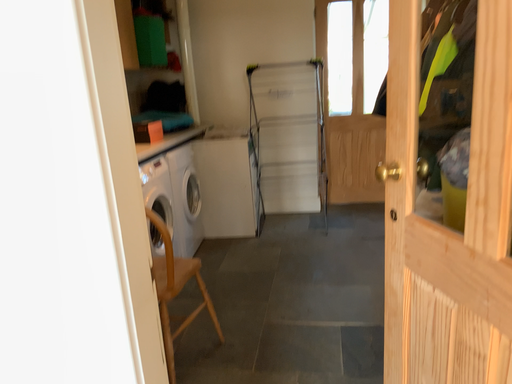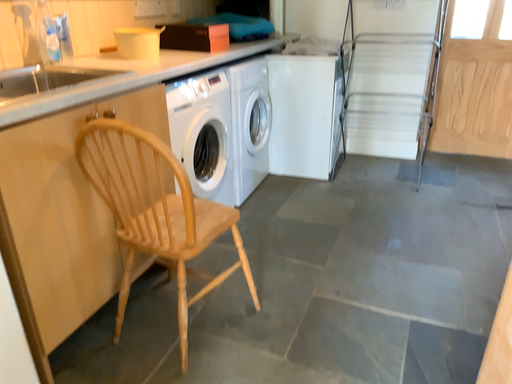
Question: How did the camera likely rotate when shooting the video?

Choices:
 (A) rotated left
 (B) rotated right

Answer: (A)